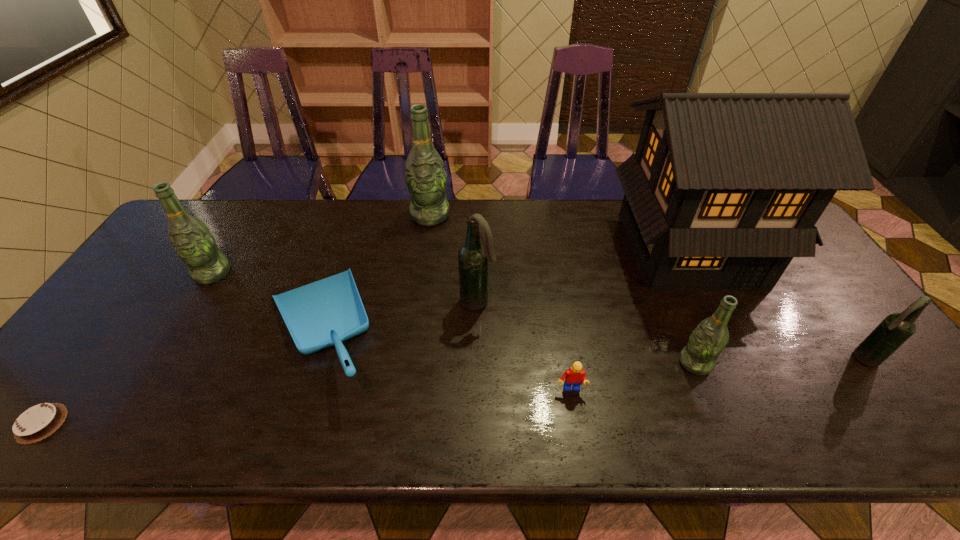
This screenshot has width=960, height=540. Find the location of `the fourth beer bottle from left to right`. the fourth beer bottle from left to right is located at coordinates (707, 341).

Identify the location of the nearest green beer bottle. The image size is (960, 540). (707, 341).

Find the location of a particular element. This screenshot has width=960, height=540. dustpan is located at coordinates (324, 313).

Locate an element on the screen. the third shortest object is located at coordinates (324, 313).

The width and height of the screenshot is (960, 540). Identify the location of red Lego. (575, 376).

The height and width of the screenshot is (540, 960). I want to click on Lego, so click(575, 376).

Where is `the leftmost object`? the leftmost object is located at coordinates (36, 423).

Find the location of a particular element. The image size is (960, 540). the shortest object is located at coordinates (36, 423).

Image resolution: width=960 pixels, height=540 pixels. I want to click on free space located on the front-facing side of the tallest object, so click(x=780, y=429).

What are the coordinates of `free space located on the surface of the eighth shortest object` in the screenshot? It's located at (419, 301).